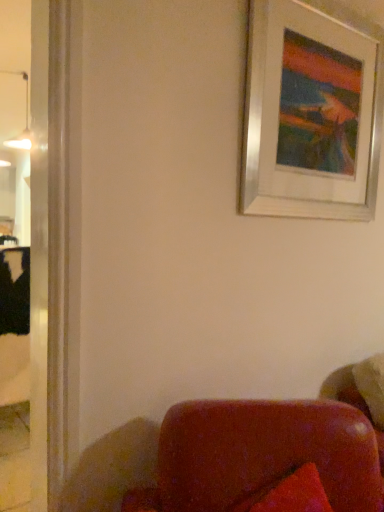
Question: Looking at the image, does silver metallic picture frame at upper right seem bigger or smaller compared to matte white lamp at upper left?

Choices:
 (A) small
 (B) big

Answer: (B)

Question: Considering the positions of silver metallic picture frame at upper right and matte white lamp at upper left in the image, is silver metallic picture frame at upper right wider or thinner than matte white lamp at upper left?

Choices:
 (A) thin
 (B) wide

Answer: (A)

Question: Is point (331, 178) closer or farther from the camera than point (23, 72)?

Choices:
 (A) closer
 (B) farther

Answer: (A)

Question: Considering the positions of matte white lamp at upper left and silver metallic picture frame at upper right in the image, is matte white lamp at upper left taller or shorter than silver metallic picture frame at upper right?

Choices:
 (A) tall
 (B) short

Answer: (B)

Question: From the image's perspective, is matte white lamp at upper left located above or below silver metallic picture frame at upper right?

Choices:
 (A) above
 (B) below

Answer: (A)

Question: Would you say matte white lamp at upper left is to the left or to the right of silver metallic picture frame at upper right in the picture?

Choices:
 (A) left
 (B) right

Answer: (A)

Question: Looking at the image, does matte white lamp at upper left seem bigger or smaller compared to silver metallic picture frame at upper right?

Choices:
 (A) small
 (B) big

Answer: (A)